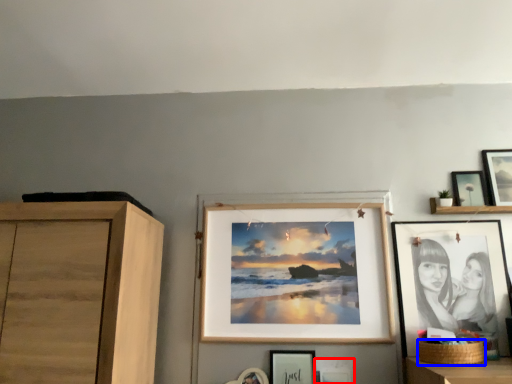
Question: Which object appears farthest to the camera in this image, picture frame (highlighted by a red box) or basket (highlighted by a blue box)?

Choices:
 (A) picture frame
 (B) basket

Answer: (A)